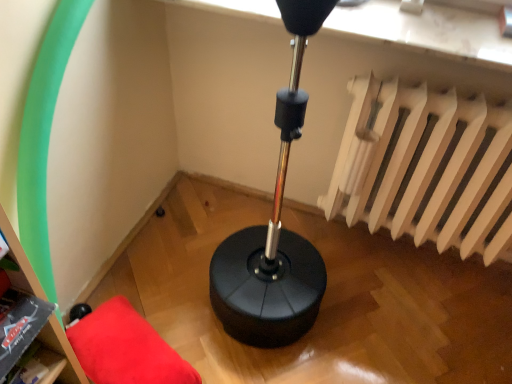
What do you see at coordinates (425, 168) in the screenshot? I see `white matte radiator at upper right` at bounding box center [425, 168].

Where is `matte black bookshelf at lower left`? The width and height of the screenshot is (512, 384). matte black bookshelf at lower left is located at coordinates (61, 351).

Is matte black bookshelf at lower left wider or thinner than red fabric cushion at lower left?

matte black bookshelf at lower left is thinner than red fabric cushion at lower left.

Is the depth of matte black bookshelf at lower left greater than that of red fabric cushion at lower left?

That is False.

From a real-world perspective, which is physically below, matte black bookshelf at lower left or red fabric cushion at lower left?

red fabric cushion at lower left, from a real-world perspective.

From the image's perspective, is matte black bookshelf at lower left located beneath red fabric cushion at lower left?

Actually, matte black bookshelf at lower left appears above red fabric cushion at lower left in the image.

Considering the positions of point (125, 309) and point (51, 347), is point (125, 309) closer or farther from the camera than point (51, 347)?

Point (125, 309).

Is red fabric cushion at lower left positioned far away from matte black bookshelf at lower left?

No, red fabric cushion at lower left is not far away from matte black bookshelf at lower left.

What's the angular difference between red fabric cushion at lower left and matte black bookshelf at lower left's facing directions?

154 degrees separate the facing orientations of red fabric cushion at lower left and matte black bookshelf at lower left.

Which is in front, red fabric cushion at lower left or matte black bookshelf at lower left?

matte black bookshelf at lower left.

Does white matte radiator at upper right have a greater width compared to matte black bookshelf at lower left?

In fact, white matte radiator at upper right might be narrower than matte black bookshelf at lower left.

From a real-world perspective, is white matte radiator at upper right positioned above or below matte black bookshelf at lower left?

From a real-world perspective, white matte radiator at upper right is physically below matte black bookshelf at lower left.

Does white matte radiator at upper right have a smaller size compared to matte black bookshelf at lower left?

No, white matte radiator at upper right is not smaller than matte black bookshelf at lower left.

From the picture: From the image's perspective, which is below, white matte radiator at upper right or matte black bookshelf at lower left?

matte black bookshelf at lower left appears lower in the image.

Is matte black bookshelf at lower left wider or thinner than white matte radiator at upper right?

Clearly, matte black bookshelf at lower left has more width compared to white matte radiator at upper right.

From a real-world perspective, which object stands above the other?

matte black bookshelf at lower left, from a real-world perspective.

Looking at this image, which point is more forward, (85, 381) or (455, 203)?

The point (85, 381) is closer to the camera.

In terms of height, does matte black bookshelf at lower left look taller or shorter compared to white matte radiator at upper right?

Clearly, matte black bookshelf at lower left is shorter compared to white matte radiator at upper right.

How many degrees apart are the facing directions of white matte radiator at upper right and red fabric cushion at lower left?

115 degrees separate the facing orientations of white matte radiator at upper right and red fabric cushion at lower left.

Considering the relative positions of white matte radiator at upper right and red fabric cushion at lower left in the image provided, is white matte radiator at upper right to the left of red fabric cushion at lower left from the viewer's perspective?

Incorrect, white matte radiator at upper right is not on the left side of red fabric cushion at lower left.

I want to click on furniture directly beneath the white matte radiator at upper right (from a real-world perspective), so click(x=126, y=348).

From the image's perspective, would you say white matte radiator at upper right is positioned over red fabric cushion at lower left?

Indeed, from the image's perspective, white matte radiator at upper right is shown above red fabric cushion at lower left.

From a real-world perspective, which is physically below, red fabric cushion at lower left or white matte radiator at upper right?

In real-world perspective, red fabric cushion at lower left is lower.

Which of these two, red fabric cushion at lower left or white matte radiator at upper right, stands taller?

Standing taller between the two is white matte radiator at upper right.

Based on the photo, is white matte radiator at upper right located within red fabric cushion at lower left?

That's incorrect, white matte radiator at upper right is not inside red fabric cushion at lower left.

In order to click on bookshelf that is on the left side of red fabric cushion at lower left in this screenshot , I will do `click(61, 351)`.

The image size is (512, 384). I want to click on furniture behind the matte black bookshelf at lower left, so click(126, 348).

Looking at this image, based on their spatial positions, is red fabric cushion at lower left or matte black bookshelf at lower left closer to white matte radiator at upper right?

red fabric cushion at lower left lies closer to white matte radiator at upper right than the other object.

When comparing their distances from red fabric cushion at lower left, does matte black bookshelf at lower left or white matte radiator at upper right seem further?

The object further to red fabric cushion at lower left is white matte radiator at upper right.

When comparing their distances from red fabric cushion at lower left, does white matte radiator at upper right or matte black bookshelf at lower left seem further?

white matte radiator at upper right is further to red fabric cushion at lower left.

Looking at the image, which one is located closer to matte black bookshelf at lower left, red fabric cushion at lower left or white matte radiator at upper right?

The object closer to matte black bookshelf at lower left is red fabric cushion at lower left.

Considering their positions, is matte black bookshelf at lower left positioned closer to white matte radiator at upper right than red fabric cushion at lower left?

The object closer to white matte radiator at upper right is red fabric cushion at lower left.

Considering their positions, is white matte radiator at upper right positioned further to matte black bookshelf at lower left than red fabric cushion at lower left?

white matte radiator at upper right is further to matte black bookshelf at lower left.

This screenshot has width=512, height=384. In order to click on furniture between matte black bookshelf at lower left and white matte radiator at upper right in the horizontal direction in this screenshot , I will do `click(126, 348)`.